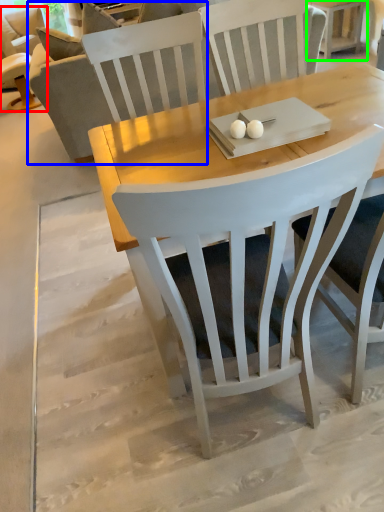
Question: Based on their relative distances, which object is nearer to chair (highlighted by a red box)? Choose from couch (highlighted by a blue box) and side table (highlighted by a green box).

Choices:
 (A) couch
 (B) side table

Answer: (A)